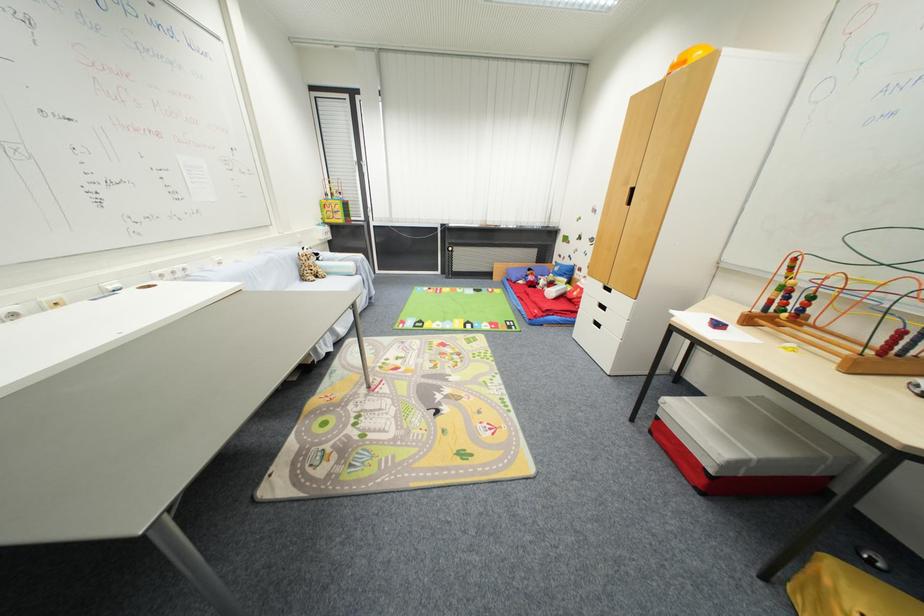
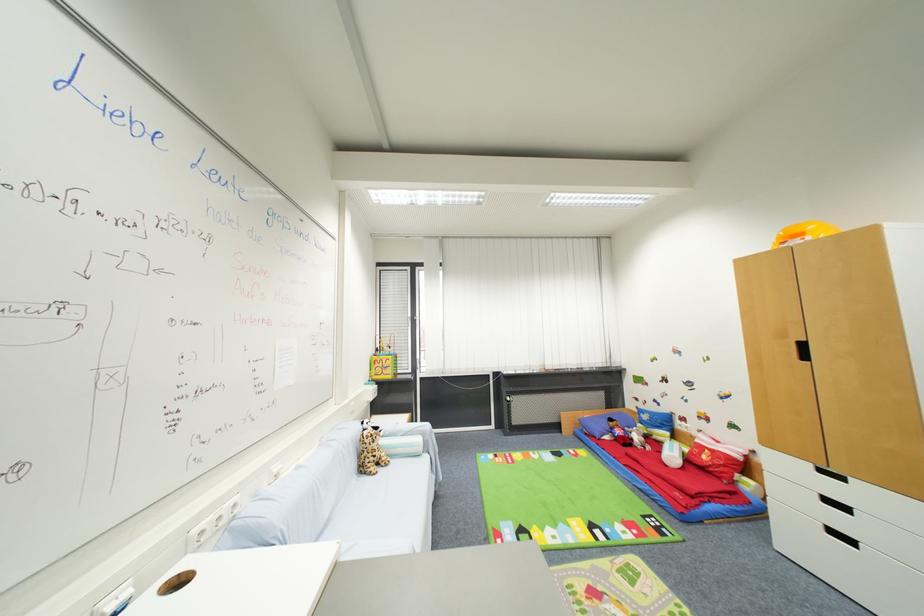
Locate, in the second image, the point that corresponds to (x=609, y=310) in the first image.

(849, 509)